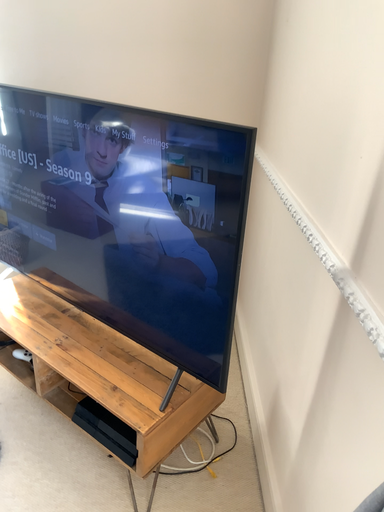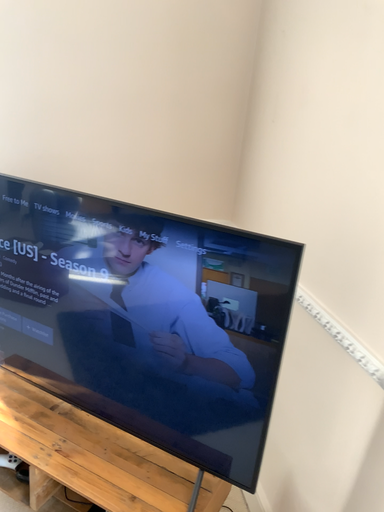
Question: How did the camera likely rotate when shooting the video?

Choices:
 (A) rotated right
 (B) rotated left

Answer: (A)